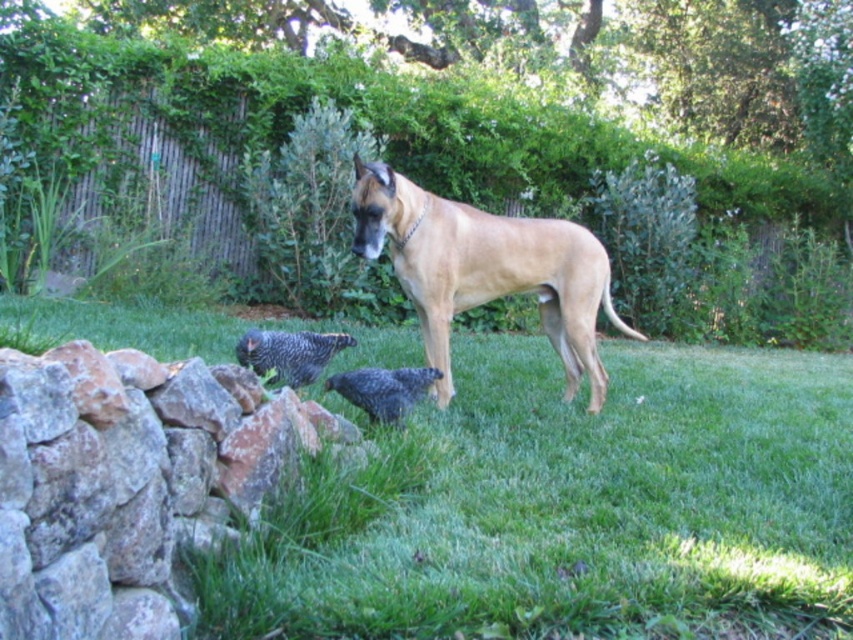
You are a photographer trying to capture the golden tan fur at center and the rustic stone wall at lower left in the same frame. Based on their positions, which object should you focus on first if you want both to be in focus?

The rustic stone wall at lower left is located below the golden tan fur at center. To have both in focus, you should focus on the golden tan fur at center first since it is closer to the camera.

You are a gardener planning to plant flowers in the green grass at lower center. To ensure the flowers are visible from the path behind the rustic stone wall at lower left, where should you plant them?

The rustic stone wall at lower left is behind the green grass at lower center, so you should plant the flowers in the green grass at lower center closer to the wall to ensure they are visible from the path behind.

You are standing in the outdoor scene and want to place a small toy between the green grass at lower center and the golden tan fur at center. Which object should the toy be closer to if you want it to be nearer to the viewer?

The toy should be placed closer to the green grass at lower center because it is nearer to the viewer compared to the golden tan fur at center.